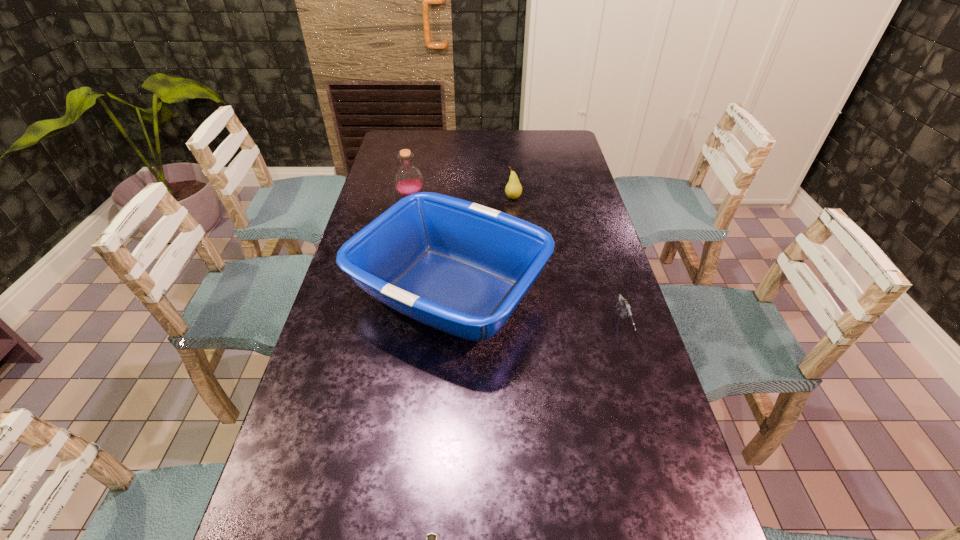
Point out which object is positioned as the nearest to the bottle. Please provide its 2D coordinates. Your answer should be formatted as a tuple, i.e. [(x, y)], where the tuple contains the x and y coordinates of a point satisfying the conditions above.

[(460, 267)]

Choose which object is the third nearest neighbor to the tray. Please provide its 2D coordinates. Your answer should be formatted as a tuple, i.e. [(x, y)], where the tuple contains the x and y coordinates of a point satisfying the conditions above.

[(513, 189)]